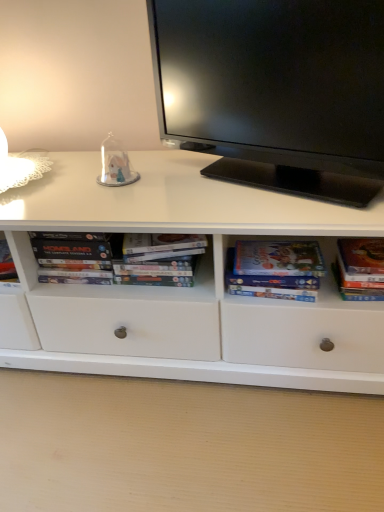
Locate an element on the screen. This screenshot has width=384, height=512. white cardboard books at center is located at coordinates (117, 259).

From the picture: What is the approximate width of matte paper book at center right, which is the 1th paperback book from left to right?

It is 5.28 inches.

The width and height of the screenshot is (384, 512). What do you see at coordinates (276, 91) in the screenshot?
I see `black glossy television at upper center` at bounding box center [276, 91].

I want to click on transparent glass dome at center, so click(115, 164).

How many degrees apart are the facing directions of matte paper book at center right, which is the 1th paperback book from left to right, and hardcover book at right, the first paperback book viewed from the right?

There is a 6.14-degree angle between the facing directions of matte paper book at center right, which is the 1th paperback book from left to right, and hardcover book at right, the first paperback book viewed from the right.

Is matte paper book at center right, the second paperback book from the right, located outside hardcover book at right, the first paperback book viewed from the right?

Indeed, matte paper book at center right, the second paperback book from the right, is completely outside hardcover book at right, the first paperback book viewed from the right.

In the scene shown: From a real-world perspective, who is located higher, matte paper book at center right, which is the 1th paperback book from left to right, or hardcover book at right, the first paperback book viewed from the right?

From a 3D spatial view, matte paper book at center right, which is the 1th paperback book from left to right, is above.

In the scene shown: From the image's perspective, does matte paper book at center right, the second paperback book from the right, appear higher than hardcover book at right, the 2th paperback book in the left-to-right sequence?

Yes, from the image's perspective, matte paper book at center right, the second paperback book from the right, is over hardcover book at right, the 2th paperback book in the left-to-right sequence.

Which of these two, white cardboard books at center or transparent glass dome at center, is thinner?

Thinner between the two is transparent glass dome at center.

Are white cardboard books at center and transparent glass dome at center located far from each other?

No, white cardboard books at center is in close proximity to transparent glass dome at center.

Considering the points (78, 264) and (118, 145), which point is in front, point (78, 264) or point (118, 145)?

The point (78, 264) is closer.

Is transparent glass dome at center at the right side of matte paper book at center right, the second paperback book from the right?

No.

Image resolution: width=384 pixels, height=512 pixels. Identify the location of the 1st paperback book below the transparent glass dome at center (from a real-world perspective). (278, 258).

Is point (137, 173) closer to camera compared to point (264, 268)?

That is False.

From the image's perspective, is transparent glass dome at center located above or below matte paper book at center right, the second paperback book from the right?

Clearly, from the image's perspective, transparent glass dome at center is above matte paper book at center right, the second paperback book from the right.

From the picture: Does matte paper book at center right, which is the 1th paperback book from left to right, lie in front of white cardboard books at center?

That is True.

Which of these two, matte paper book at center right, the second paperback book from the right, or white cardboard books at center, stands shorter?

matte paper book at center right, the second paperback book from the right.

How many degrees apart are the facing directions of matte paper book at center right, the second paperback book from the right, and white cardboard books at center?

They differ by 0.661 degrees in their facing directions.

From the image's perspective, would you say hardcover book at right, the 2th paperback book in the left-to-right sequence, is positioned over white cardboard books at center?

Actually, hardcover book at right, the 2th paperback book in the left-to-right sequence, appears below white cardboard books at center in the image.

Is point (349, 272) positioned before point (167, 250)?

Yes, point (349, 272) is closer to viewer.

What are the coordinates of `book on the left of the hardcover book at right, the first paperback book viewed from the right` in the screenshot? It's located at (117, 259).

Does hardcover book at right, the 2th paperback book in the left-to-right sequence, appear on the left side of white cardboard books at center?

No.

Which is further, (183, 244) or (322, 19)?

The point (183, 244) is more distant.

Considering the sizes of objects white cardboard books at center and black glossy television at upper center in the image provided, who is wider, white cardboard books at center or black glossy television at upper center?

Wider between the two is black glossy television at upper center.

Can you tell me how much white cardboard books at center and black glossy television at upper center differ in facing direction?

The angular difference between white cardboard books at center and black glossy television at upper center is 32.7 degrees.

From their relative heights in the image, would you say white cardboard books at center is taller or shorter than black glossy television at upper center?

In the image, white cardboard books at center appears to be shorter than black glossy television at upper center.

Is black glossy television at upper center to the right of transparent glass dome at center from the viewer's perspective?

Correct, you'll find black glossy television at upper center to the right of transparent glass dome at center.

Does black glossy television at upper center have a lesser height compared to transparent glass dome at center?

Incorrect, the height of black glossy television at upper center does not fall short of that of transparent glass dome at center.

From the image's perspective, which one is positioned higher, black glossy television at upper center or transparent glass dome at center?

From the image's view, black glossy television at upper center is above.

The width and height of the screenshot is (384, 512). Identify the location of paperback book in front of the matte paper book at center right, which is the 1th paperback book from left to right. (361, 269).

I want to click on toy above the white cardboard books at center (from a real-world perspective), so click(x=115, y=164).

Which object lies further to the anchor point white cardboard books at center, transparent glass dome at center or black glossy television at upper center?

black glossy television at upper center.

Consider the image. Which object lies nearer to the anchor point white cardboard books at center, hardcover book at right, the 2th paperback book in the left-to-right sequence, or matte paper book at center right, which is the 1th paperback book from left to right?

Among the two, matte paper book at center right, which is the 1th paperback book from left to right, is located nearer to white cardboard books at center.

Based on their spatial positions, is transparent glass dome at center or black glossy television at upper center further from matte paper book at center right, the second paperback book from the right?

Among the two, transparent glass dome at center is located further to matte paper book at center right, the second paperback book from the right.

Estimate the real-world distances between objects in this image. Which object is further from transparent glass dome at center, hardcover book at right, the first paperback book viewed from the right, or white cardboard books at center?

The object further to transparent glass dome at center is hardcover book at right, the first paperback book viewed from the right.

Considering their positions, is matte paper book at center right, which is the 1th paperback book from left to right, positioned closer to hardcover book at right, the first paperback book viewed from the right, than black glossy television at upper center?

matte paper book at center right, which is the 1th paperback book from left to right, is positioned closer to the anchor hardcover book at right, the first paperback book viewed from the right.

When comparing their distances from white cardboard books at center, does transparent glass dome at center or hardcover book at right, the first paperback book viewed from the right, seem further?

Based on the image, hardcover book at right, the first paperback book viewed from the right, appears to be further to white cardboard books at center.

Considering their positions, is white cardboard books at center positioned closer to hardcover book at right, the 2th paperback book in the left-to-right sequence, than black glossy television at upper center?

black glossy television at upper center.

From the image, which object appears to be nearer to hardcover book at right, the 2th paperback book in the left-to-right sequence, black glossy television at upper center or matte paper book at center right, the second paperback book from the right?

Among the two, matte paper book at center right, the second paperback book from the right, is located nearer to hardcover book at right, the 2th paperback book in the left-to-right sequence.

Identify the location of paperback book between black glossy television at upper center and hardcover book at right, the first paperback book viewed from the right, vertically. The height and width of the screenshot is (512, 384). (278, 258).

At what (x,y) coordinates should I click in order to perform the action: click on television between transparent glass dome at center and matte paper book at center right, which is the 1th paperback book from left to right. Please return your answer as a coordinate pair (x, y). Image resolution: width=384 pixels, height=512 pixels. Looking at the image, I should click on (276, 91).

Where is `book between transparent glass dome at center and matte paper book at center right, the second paperback book from the right`? The width and height of the screenshot is (384, 512). book between transparent glass dome at center and matte paper book at center right, the second paperback book from the right is located at coordinates (117, 259).

Locate an element on the screen. book between black glossy television at upper center and matte paper book at center right, which is the 1th paperback book from left to right, from top to bottom is located at coordinates (117, 259).